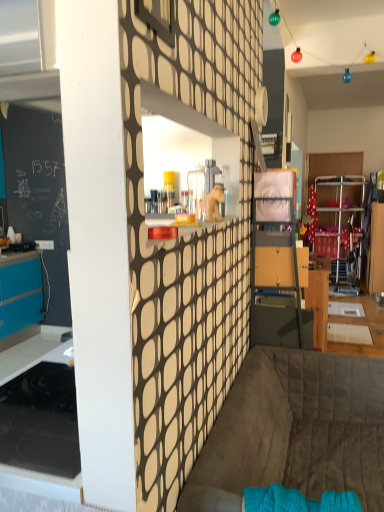
What do you see at coordinates (274, 267) in the screenshot?
I see `wooden drawer at center` at bounding box center [274, 267].

Locate an element on the screen. The width and height of the screenshot is (384, 512). wooden drawer at center is located at coordinates (274, 267).

From the image's perspective, is matte glass window at upper center on wooden drawer at center?

Indeed, from the image's perspective, matte glass window at upper center is shown above wooden drawer at center.

Measure the distance between matte glass window at upper center and wooden drawer at center.

A distance of 5.13 feet exists between matte glass window at upper center and wooden drawer at center.

Is matte glass window at upper center turned away from wooden drawer at center?

No, matte glass window at upper center is not facing the opposite direction of wooden drawer at center.

Is wooden drawer at center a part of matte glass window at upper center?

Actually, wooden drawer at center is outside matte glass window at upper center.

From the image's perspective, is dark gray quilted couch at lower center located beneath matte glass window at upper center?

Yes, from the image's perspective, dark gray quilted couch at lower center is below matte glass window at upper center.

Considering the positions of point (224, 488) and point (167, 13), is point (224, 488) closer or farther from the camera than point (167, 13)?

Clearly, point (224, 488) is more distant from the camera than point (167, 13).

Who is more distant, dark gray quilted couch at lower center or matte glass window at upper center?

dark gray quilted couch at lower center is more distant.

Consider the image. Is there a large distance between dark gray quilted couch at lower center and matte glass window at upper center?

dark gray quilted couch at lower center is far away from matte glass window at upper center.

Is point (286, 256) positioned in front of point (251, 377)?

That is False.

Is wooden drawer at center positioned far away from dark gray quilted couch at lower center?

No.

I want to click on couch on the left of wooden drawer at center, so click(297, 428).

Does point (198, 489) appear closer or farther from the camera than point (302, 254)?

Point (198, 489) is positioned closer to the camera compared to point (302, 254).

Between dark gray quilted couch at lower center and wooden drawer at center, which one has less height?

Standing shorter between the two is wooden drawer at center.

Can you tell me how much dark gray quilted couch at lower center and wooden drawer at center differ in facing direction?

The angle between the facing direction of dark gray quilted couch at lower center and the facing direction of wooden drawer at center is 0.626 degrees.

From a real-world perspective, is wooden drawer at center positioned under matte glass window at upper center based on gravity?

Yes, from a real-world perspective, wooden drawer at center is beneath matte glass window at upper center.

Could you tell me if wooden drawer at center is facing matte glass window at upper center?

No.

From the image's perspective, would you say wooden drawer at center is positioned over matte glass window at upper center?

No, from the image's perspective, wooden drawer at center is not on top of matte glass window at upper center.

Which is more to the left, wooden drawer at center or matte glass window at upper center?

Positioned to the left is matte glass window at upper center.

From a real-world perspective, which object stands above the other?

In real-world perspective, matte glass window at upper center is above.

In terms of size, does matte glass window at upper center appear bigger or smaller than dark gray quilted couch at lower center?

Considering their sizes, matte glass window at upper center takes up less space than dark gray quilted couch at lower center.

In the scene shown: Is matte glass window at upper center positioned beyond the bounds of dark gray quilted couch at lower center?

matte glass window at upper center is positioned outside dark gray quilted couch at lower center.

Which object is thinner, matte glass window at upper center or dark gray quilted couch at lower center?

matte glass window at upper center.

Locate an element on the screen. Image resolution: width=384 pixels, height=512 pixels. drawer on the right of matte glass window at upper center is located at coordinates (274, 267).

Locate an element on the screen. Image resolution: width=384 pixels, height=512 pixels. window lying above the dark gray quilted couch at lower center (from the image's perspective) is located at coordinates tap(158, 18).

Estimate the real-world distances between objects in this image. Which object is closer to matte glass window at upper center, wooden drawer at center or dark gray quilted couch at lower center?

Based on the image, dark gray quilted couch at lower center appears to be nearer to matte glass window at upper center.

Which object lies nearer to the anchor point dark gray quilted couch at lower center, wooden drawer at center or matte glass window at upper center?

Among the two, wooden drawer at center is located nearer to dark gray quilted couch at lower center.

From the image, which object appears to be nearer to wooden drawer at center, dark gray quilted couch at lower center or matte glass window at upper center?

dark gray quilted couch at lower center is positioned closer to the anchor wooden drawer at center.

Based on their spatial positions, is matte glass window at upper center or wooden drawer at center closer to dark gray quilted couch at lower center?

A: Among the two, wooden drawer at center is located nearer to dark gray quilted couch at lower center.

Which object lies further to the anchor point wooden drawer at center, matte glass window at upper center or dark gray quilted couch at lower center?

The object further to wooden drawer at center is matte glass window at upper center.

Which object lies further to the anchor point matte glass window at upper center, dark gray quilted couch at lower center or wooden drawer at center?

wooden drawer at center.

The image size is (384, 512). What are the coordinates of `drawer between matte glass window at upper center and dark gray quilted couch at lower center vertically` in the screenshot? It's located at (274, 267).